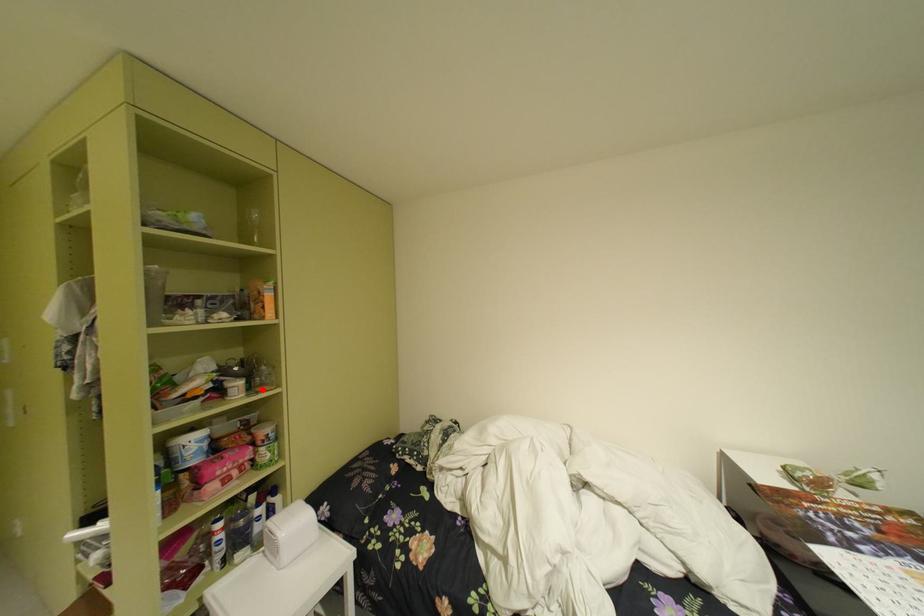
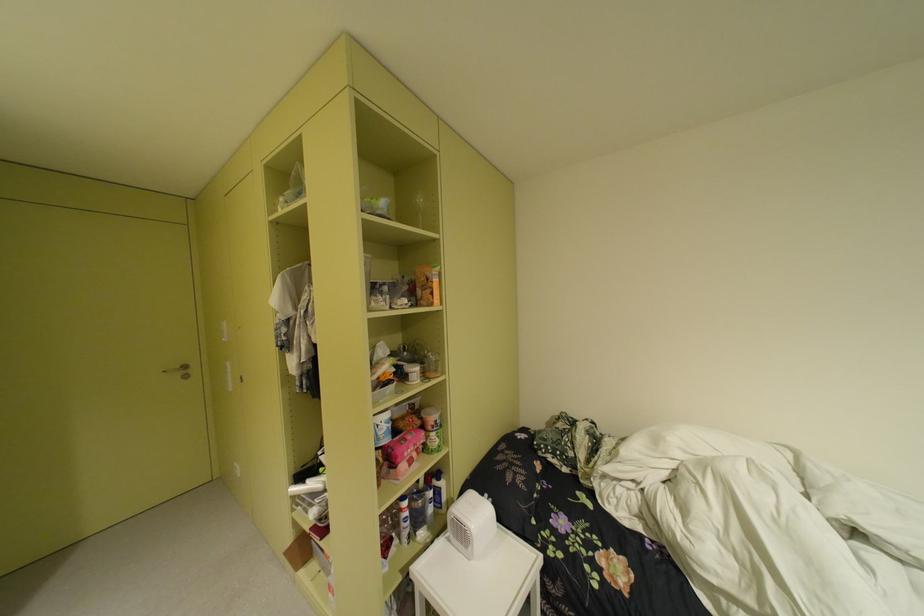
Find the pixel in the second image that matches the highlighted location in the first image.

(434, 376)